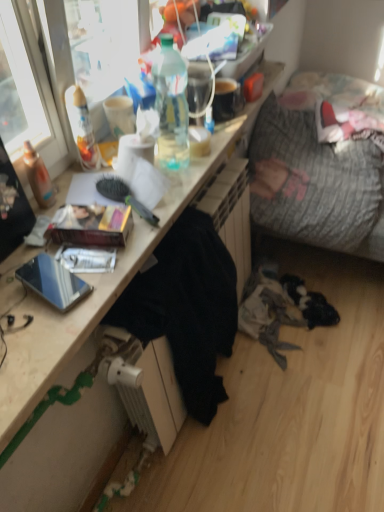
This screenshot has height=512, width=384. Find the location of `free spot to the right of shiny metallic phone at lower left`. free spot to the right of shiny metallic phone at lower left is located at coordinates (111, 275).